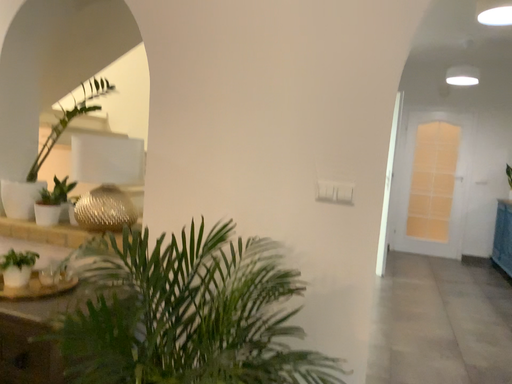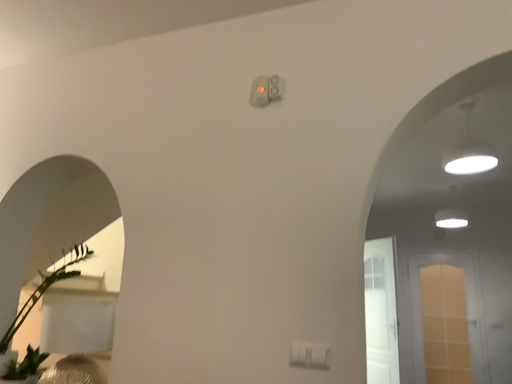
Question: Which way did the camera rotate in the video?

Choices:
 (A) rotated downward
 (B) rotated upward

Answer: (B)